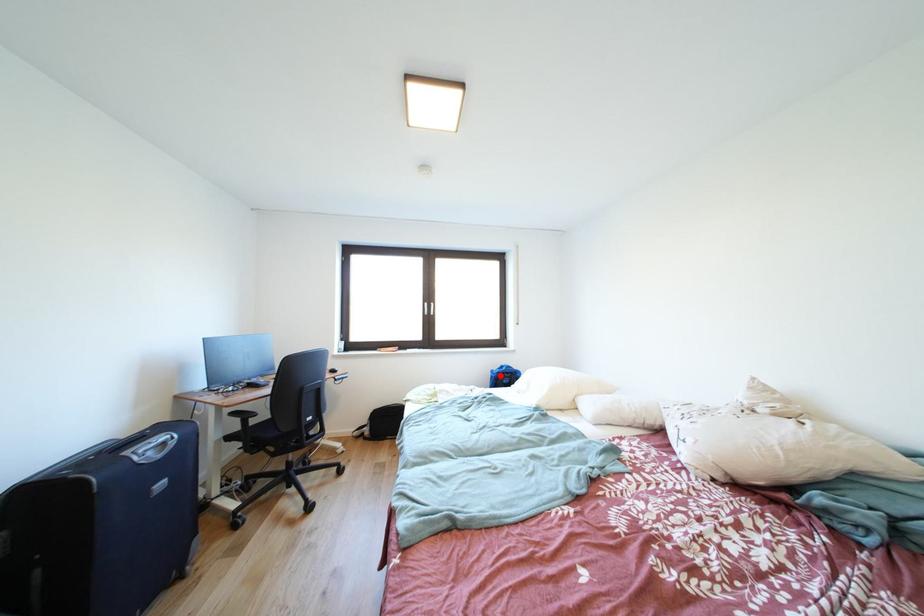
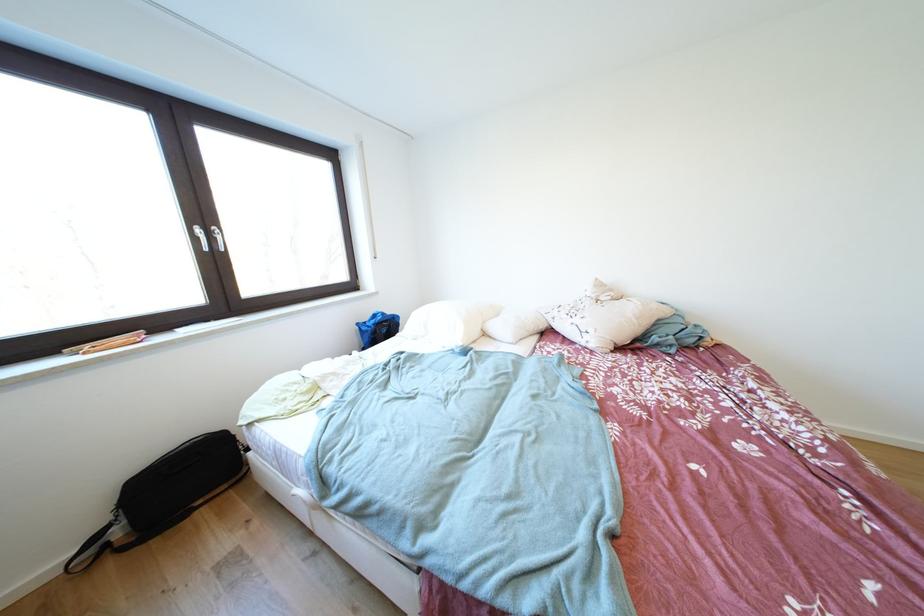
Where in the second image is the point corresponding to the highlighted location from the first image?

(367, 329)